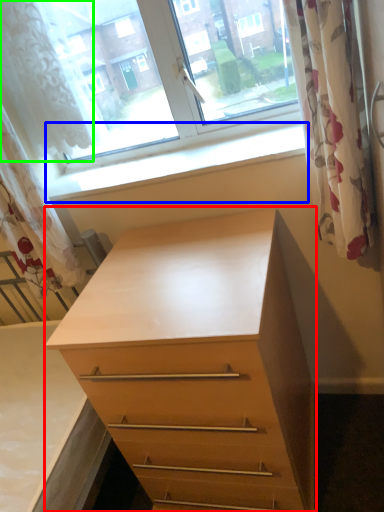
Question: Which object is positioned closest to chest of drawers (highlighted by a red box)? Select from window sill (highlighted by a blue box) and shower curtain (highlighted by a green box).

Choices:
 (A) window sill
 (B) shower curtain

Answer: (A)